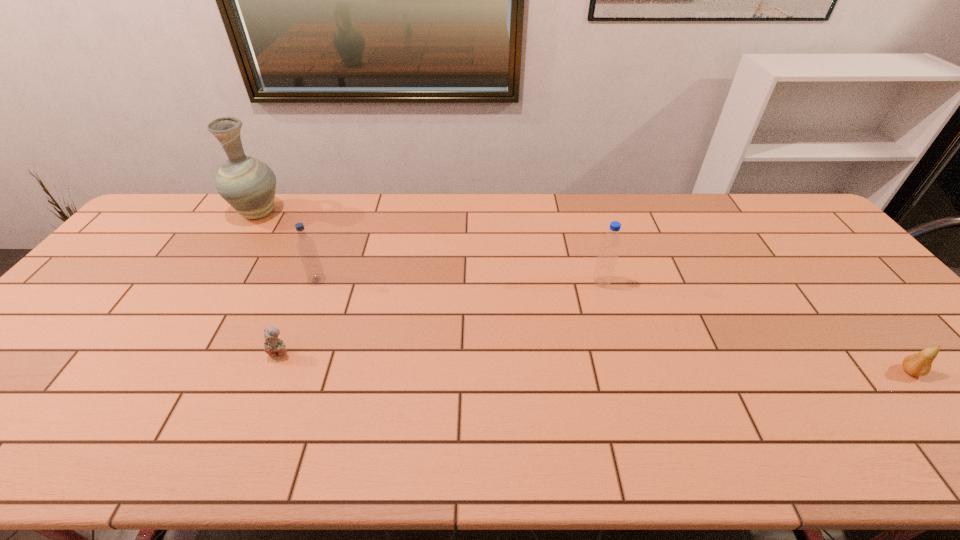
This screenshot has height=540, width=960. Identify the location of pitcher. (247, 184).

Locate an element on the screen. This screenshot has height=540, width=960. the farthest object is located at coordinates (247, 184).

Locate an element on the screen. The image size is (960, 540). the second object from right to left is located at coordinates (610, 245).

In order to click on the left water bottle in this screenshot , I will do point(306,247).

Where is `the fourth farthest object`? the fourth farthest object is located at coordinates (275, 348).

You are a GUI agent. You are given a task and a screenshot of the screen. Output one action in this format:
    pyautogui.click(x=<x>, y=<y>)
    Task: Click on the pear
    This screenshot has height=540, width=960.
    Given the screenshot: What is the action you would take?
    pyautogui.click(x=919, y=364)

Where is `the rightmost object`? Image resolution: width=960 pixels, height=540 pixels. the rightmost object is located at coordinates (919, 364).

The width and height of the screenshot is (960, 540). In order to click on free space located 0.340m on the front of the fourth object from left to right in this screenshot , I will do `click(634, 394)`.

The image size is (960, 540). In order to click on vacant region located on the right of the left water bottle in this screenshot , I will do `click(360, 279)`.

Where is `free space located 0.170m on the front-facing side of the teddy bear`? This screenshot has width=960, height=540. free space located 0.170m on the front-facing side of the teddy bear is located at coordinates (251, 426).